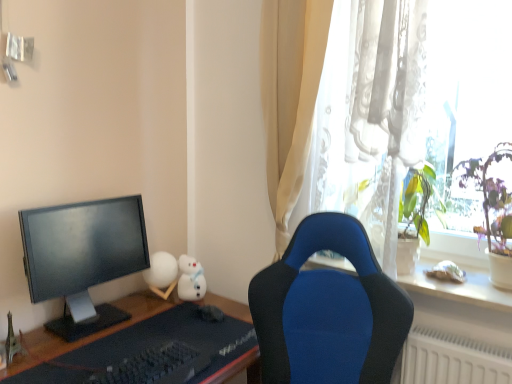
Find the location of a particular element. The width and height of the screenshot is (512, 384). vacant region under matte black monitor at left (from a real-world perspective) is located at coordinates (91, 319).